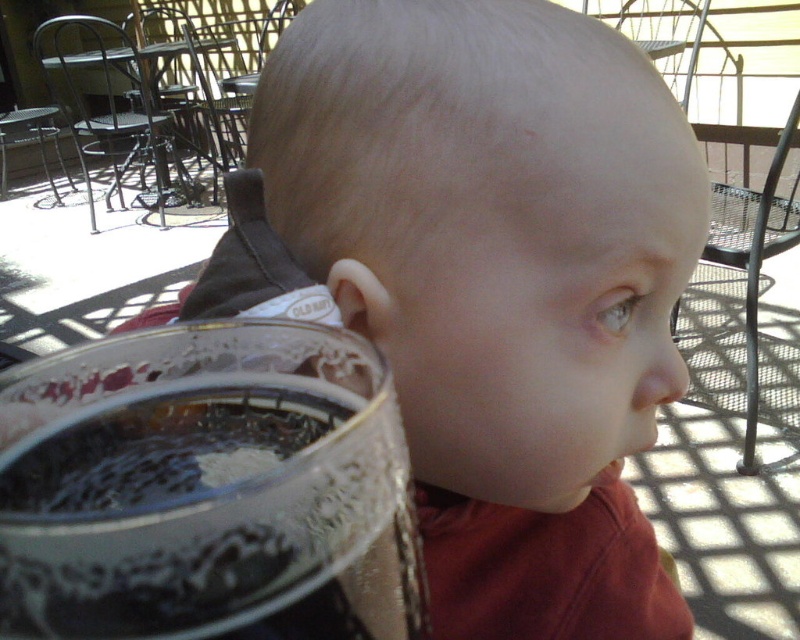
Can you confirm if matte glass cup at center-left is positioned above clear glass beer glass at lower left?

No, matte glass cup at center-left is not above clear glass beer glass at lower left.

Is matte glass cup at center-left to the right of clear glass beer glass at lower left from the viewer's perspective?

Yes, matte glass cup at center-left is to the right of clear glass beer glass at lower left.

Who is more forward, (440, 220) or (140, 376)?

Point (140, 376) is more forward.

Locate an element on the screen. Image resolution: width=800 pixels, height=640 pixels. matte glass cup at center-left is located at coordinates (492, 284).